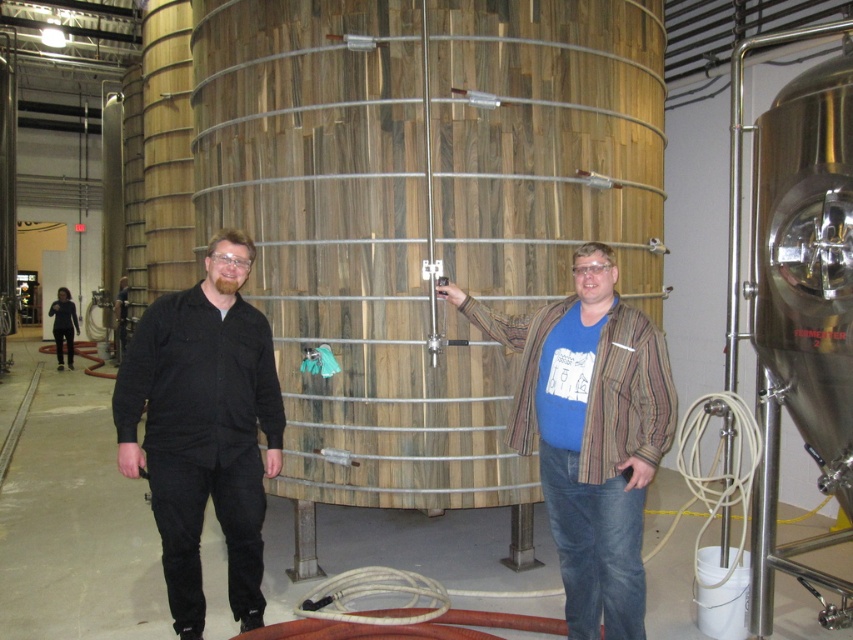
In the scene shown: Who is lower down, striped cotton shirt at center or black matte shirt at center?

black matte shirt at center is lower down.

Who is shorter, striped cotton shirt at center or black matte shirt at center?

striped cotton shirt at center is shorter.

Between point (625, 637) and point (227, 403), which one is positioned in front?

Point (625, 637) is in front.

Locate an element on the screen. The image size is (853, 640). striped cotton shirt at center is located at coordinates tap(590, 433).